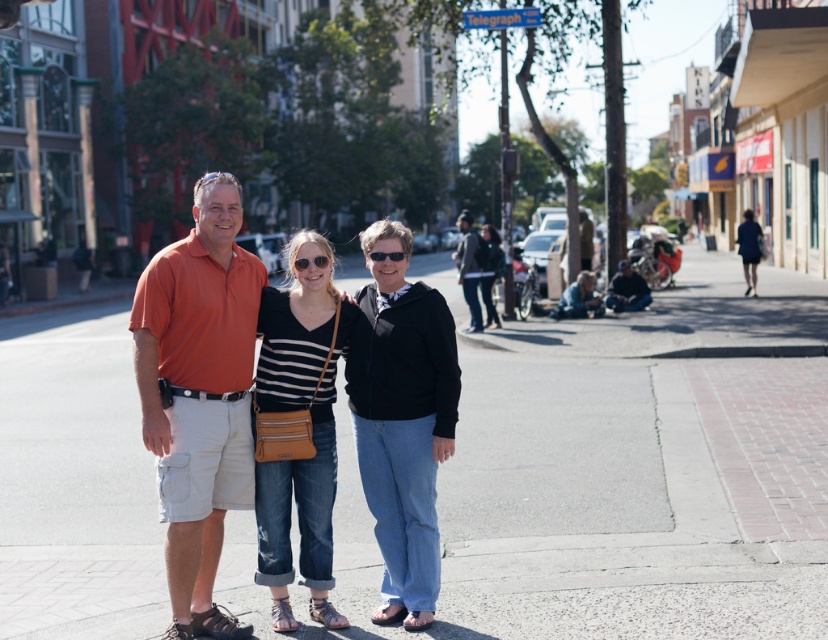
You are standing on the sidewalk and see three people. The person on the left is wearing a bright orange polo shirt, the middle person has a black and white striped top, and the person on the right is in a black hoodie. There is a point marked at coordinates (402, 420). Which clothing item is located at that point?

The point at coordinates (402, 420) indicates the black matte jacket at center.

You are a fashion designer observing the two jackets in the image. Which jacket, the black matte jacket at center or the black leather jacket at center, would you say is taller in the scene?

The black matte jacket at center is much taller as black leather jacket at center, so the black matte jacket at center is taller.